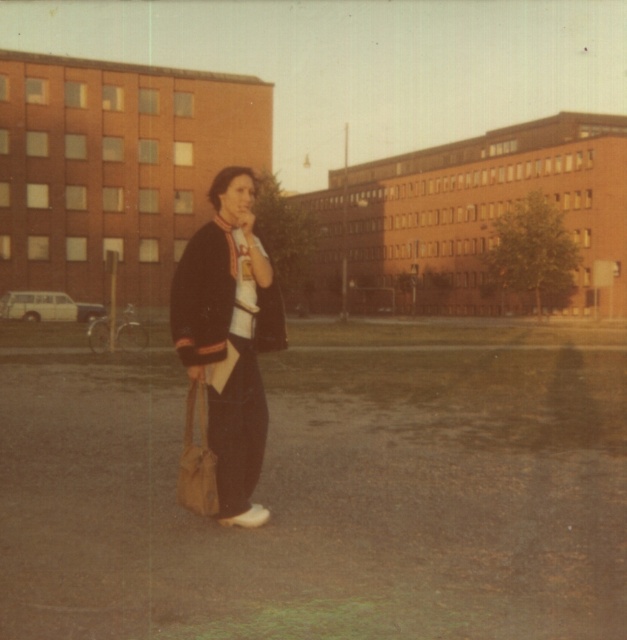
Question: From the image, what is the correct spatial relationship of matte black jacket at center in relation to leather-like brown bag at center?

Choices:
 (A) left
 (B) right

Answer: (B)

Question: Can you confirm if matte black jacket at center is positioned above leather-like brown bag at center?

Choices:
 (A) yes
 (B) no

Answer: (A)

Question: Can you confirm if matte black jacket at center is wider than leather-like brown bag at center?

Choices:
 (A) yes
 (B) no

Answer: (A)

Question: Which object appears farthest from the camera in this image?

Choices:
 (A) leather-like brown bag at center
 (B) matte black jacket at center

Answer: (A)

Question: Which point is farther to the camera?

Choices:
 (A) (206, 346)
 (B) (187, 486)

Answer: (B)